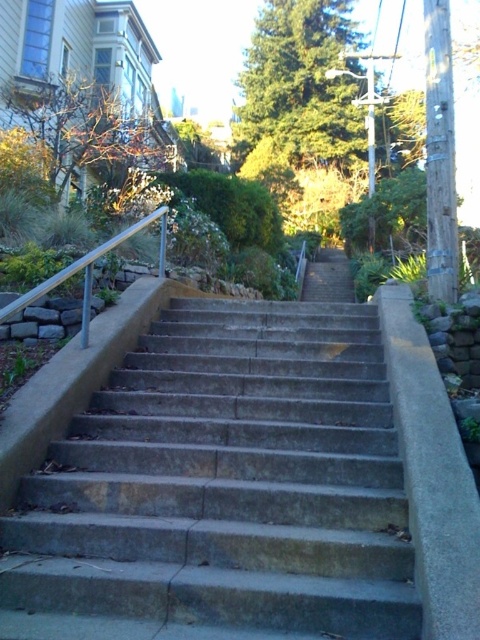
You are a painter who needs to apply a fresh coat of paint to both the concrete stairs at center and the satin silver railing at left. If you have enough paint for only one of them, which one should you choose based on their sizes?

The concrete stairs at center are wider than the satin silver railing at left, so you should choose to paint the concrete stairs at center first since it requires more paint.

Based on the photo, you are standing at the point labeled point (222, 490). Which direction should you move to reach the concrete stairs at center?

The point labeled point (222, 490) is the exact location of the concrete stairs at center, so you are already at the stairs.